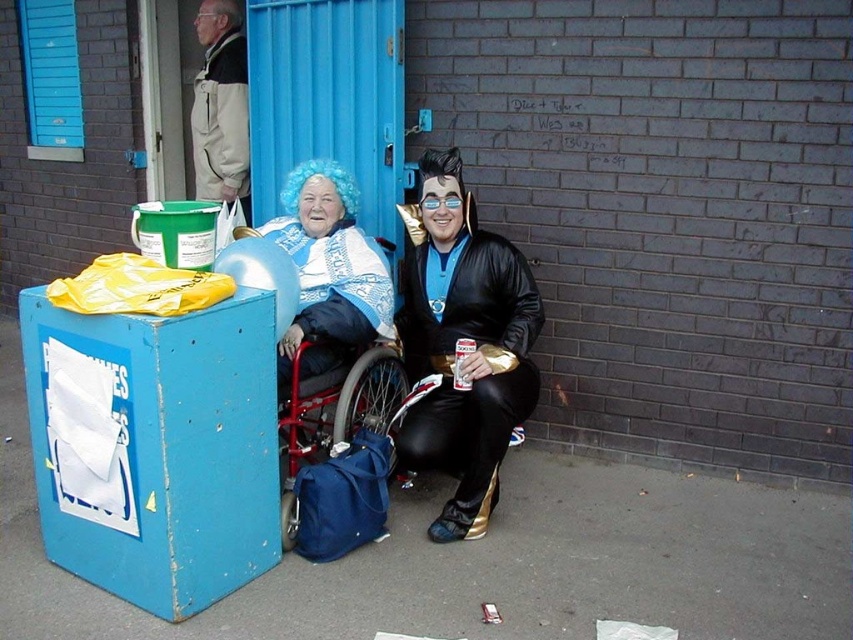
Looking at this image, you are a photographer setting up a shoot in this scene. You need to decide which of the two subjects, the shiny black costume at center or the light beige jacket at upper left, requires a wider frame to capture their full width. Based on the scene description, which one should you adjust your camera settings for?

The shiny black costume at center requires a wider frame because its width is larger than the light beige jacket at upper left.

You are standing in front of the brick wall and blue door. There are two points marked in the image. Which point, point (461, 236) or point (380, 248), is closer to you?

Point (461, 236) is closer to the camera than point (380, 248).